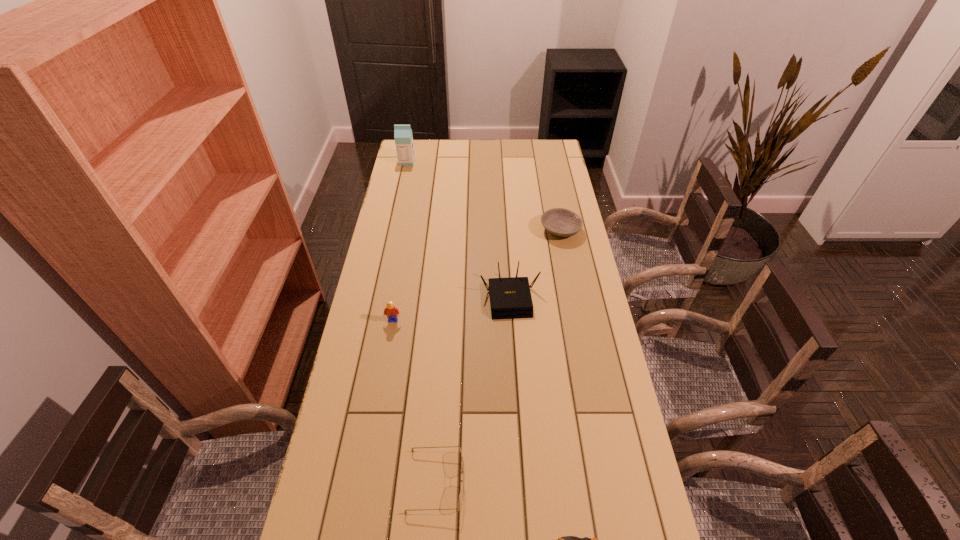
In the image, there is a desktop. Identify the location of vacant area at the far left corner. (418, 141).

In the image, there is a desktop. Where is `free region at the far right corner`? The width and height of the screenshot is (960, 540). free region at the far right corner is located at coordinates (533, 164).

Identify the location of free space between the bowl and the milk carton. (484, 195).

You are a GUI agent. You are given a task and a screenshot of the screen. Output one action in this format:
    pyautogui.click(x=<x>, y=<y>)
    Task: Click on the free space between the tallest object and the second object from left to right
    The height and width of the screenshot is (540, 960).
    Given the screenshot: What is the action you would take?
    [400, 241]

Where is `free space between the tallest object and the router`? The width and height of the screenshot is (960, 540). free space between the tallest object and the router is located at coordinates (459, 230).

This screenshot has height=540, width=960. Identify the location of unoccupied position between the bowl and the router. (535, 264).

Where is `vacant space in between the Lego and the bowl`? The image size is (960, 540). vacant space in between the Lego and the bowl is located at coordinates (477, 275).

The height and width of the screenshot is (540, 960). Identify the location of free spot between the third object from left to right and the fifth object from right to left. (415, 401).

Where is `vacant region between the router and the fifth farthest object`? This screenshot has width=960, height=540. vacant region between the router and the fifth farthest object is located at coordinates (473, 389).

Where is `vacant region between the router and the third object from left to right`? vacant region between the router and the third object from left to right is located at coordinates (473, 389).